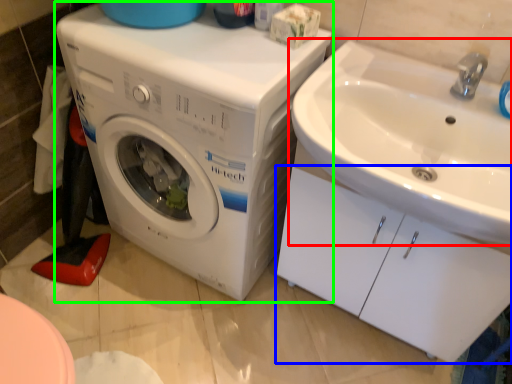
Question: Which object is positioned closest to sink (highlighted by a red box)? Select from drawer (highlighted by a blue box) and washing machine (highlighted by a green box).

Choices:
 (A) drawer
 (B) washing machine

Answer: (A)